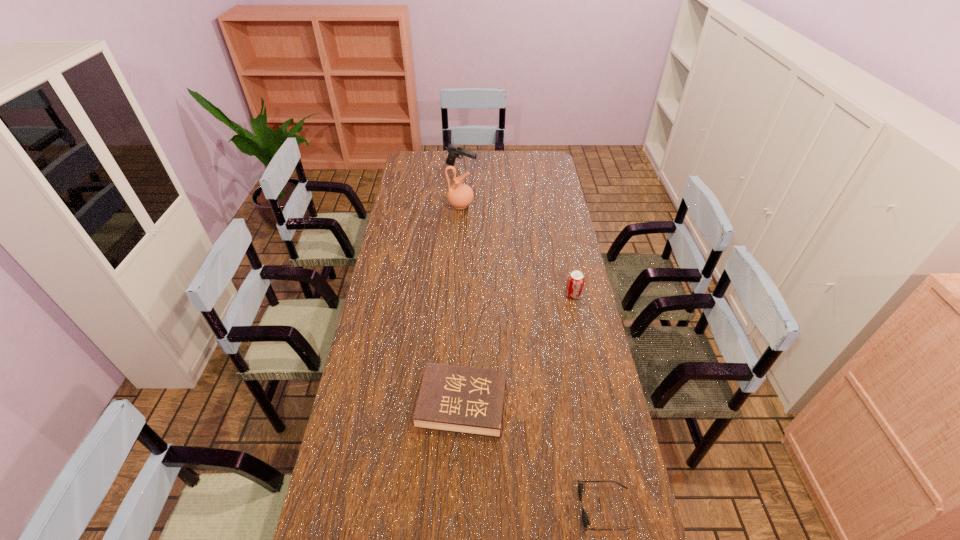
In order to click on vacant region between the third nearest object and the hardback book in this screenshot , I will do `click(517, 349)`.

Where is `free point between the sunglasses and the second tallest object`? free point between the sunglasses and the second tallest object is located at coordinates (534, 339).

This screenshot has width=960, height=540. I want to click on free space between the second shortest object and the gun, so click(x=462, y=286).

Locate an element on the screen. The width and height of the screenshot is (960, 540). vacant area between the fourth nearest object and the second nearest object is located at coordinates (461, 305).

This screenshot has width=960, height=540. Identify the location of blank region between the pottery and the third farthest object. (516, 250).

You are a GUI agent. You are given a task and a screenshot of the screen. Output one action in this format:
    pyautogui.click(x=<x>, y=<y>)
    Task: Click on the object that is the second closest one to the nearest object
    The image size is (960, 540).
    Given the screenshot: What is the action you would take?
    pyautogui.click(x=575, y=283)

Locate an element on the screen. Image resolution: width=960 pixels, height=540 pixels. object that ranks as the closest to the second shortest object is located at coordinates (585, 520).

Where is `free space in the image that satisfies the following two spatial constraints: 1. at the muzzle of the second nearest object; 2. on the left side of the gun`? This screenshot has width=960, height=540. free space in the image that satisfies the following two spatial constraints: 1. at the muzzle of the second nearest object; 2. on the left side of the gun is located at coordinates (447, 404).

Find the location of `vacant position in the image that satisfies the following two spatial constraints: 1. at the muzzle of the hardback book; 2. on the left side of the gun`. vacant position in the image that satisfies the following two spatial constraints: 1. at the muzzle of the hardback book; 2. on the left side of the gun is located at coordinates (447, 404).

This screenshot has width=960, height=540. In order to click on vacant space that satisfies the following two spatial constraints: 1. at the muzzle of the fourth shortest object; 2. on the right side of the hardback book in this screenshot , I will do `click(447, 404)`.